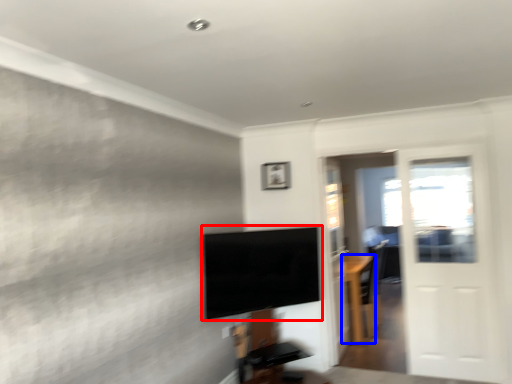
Question: Which of the following is the closest to the observer, television (highlighted by a red box) or furniture (highlighted by a blue box)?

Choices:
 (A) television
 (B) furniture

Answer: (A)